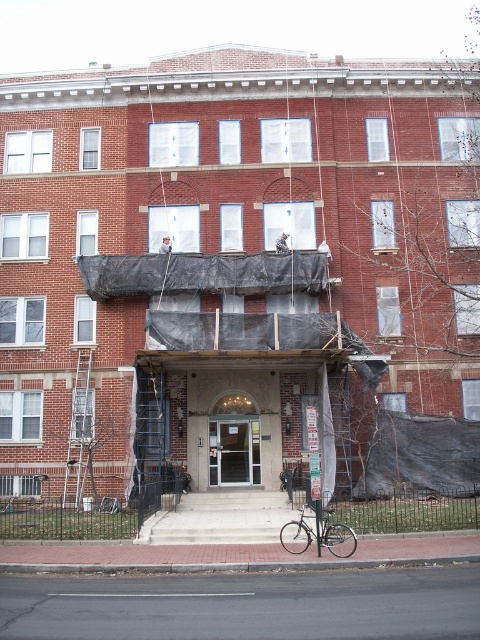
Which is more to the left, black tarp at center or matte glass door at center?

black tarp at center is more to the left.

Who is more forward, (331, 452) or (251, 420)?

Positioned in front is point (331, 452).

The height and width of the screenshot is (640, 480). I want to click on black tarp at center, so click(x=230, y=253).

Who is more distant from viewer, (253, 468) or (322, 522)?

Point (253, 468)

Does matte glass door at center appear on the left side of silver metallic bicycle at center?

Indeed, matte glass door at center is positioned on the left side of silver metallic bicycle at center.

Locate an element on the screen. The height and width of the screenshot is (640, 480). matte glass door at center is located at coordinates (233, 452).

Who is positioned more to the left, black tarp at center or silver metallic bicycle at center?

From the viewer's perspective, black tarp at center appears more on the left side.

Consider the image. Is black tarp at center above silver metallic bicycle at center?

Yes, black tarp at center is above silver metallic bicycle at center.

Who is more distant from viewer, (x=46, y=440) or (x=284, y=536)?

Point (x=46, y=440)

Where is `black tarp at center`? The image size is (480, 640). black tarp at center is located at coordinates (230, 253).